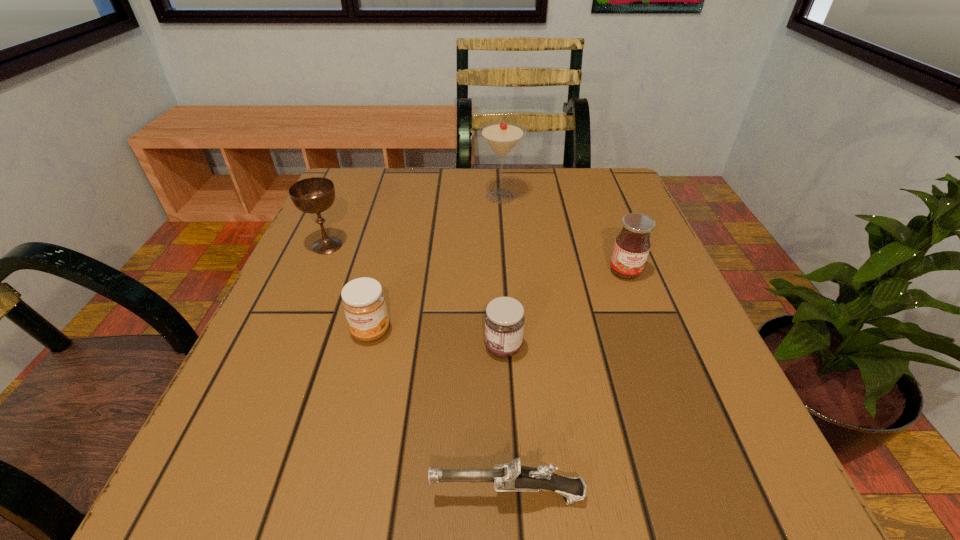
Image resolution: width=960 pixels, height=540 pixels. I want to click on object situated at the near edge, so click(511, 477).

You are a GUI agent. You are given a task and a screenshot of the screen. Output one action in this format:
    pyautogui.click(x=<x>, y=<y>)
    Task: Click on the chalice that is at the left edge
    The width and height of the screenshot is (960, 540).
    Given the screenshot: What is the action you would take?
    pyautogui.click(x=312, y=195)

This screenshot has width=960, height=540. I want to click on jam at the left edge, so click(x=363, y=300).

You are a GUI agent. You are given a task and a screenshot of the screen. Output one action in this format:
    pyautogui.click(x=<x>, y=<y>)
    Task: Click on the object situated at the right edge
    
    Given the screenshot: What is the action you would take?
    pyautogui.click(x=632, y=245)

Identify the location of vacant space at the far edge of the desktop. Image resolution: width=960 pixels, height=540 pixels. (482, 200).

I want to click on blank area at the near edge, so click(x=340, y=453).

The image size is (960, 540). In the image, there is a desktop. In order to click on vacant space at the left edge in this screenshot , I will do `click(319, 233)`.

Where is `vacant space at the right edge`? Image resolution: width=960 pixels, height=540 pixels. vacant space at the right edge is located at coordinates (664, 259).

Locate an element on the screen. The image size is (960, 540). free space at the far left corner of the desktop is located at coordinates (337, 212).

Identify the location of free space at the near right corner of the desktop. The height and width of the screenshot is (540, 960). (715, 489).